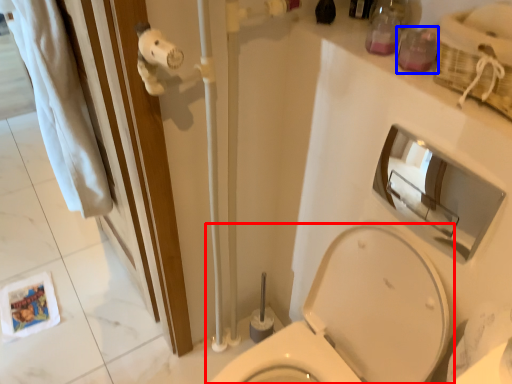
Question: Which point is closer to the camera, toilet (highlighted by a red box) or toiletry (highlighted by a blue box)?

Choices:
 (A) toilet
 (B) toiletry

Answer: (A)